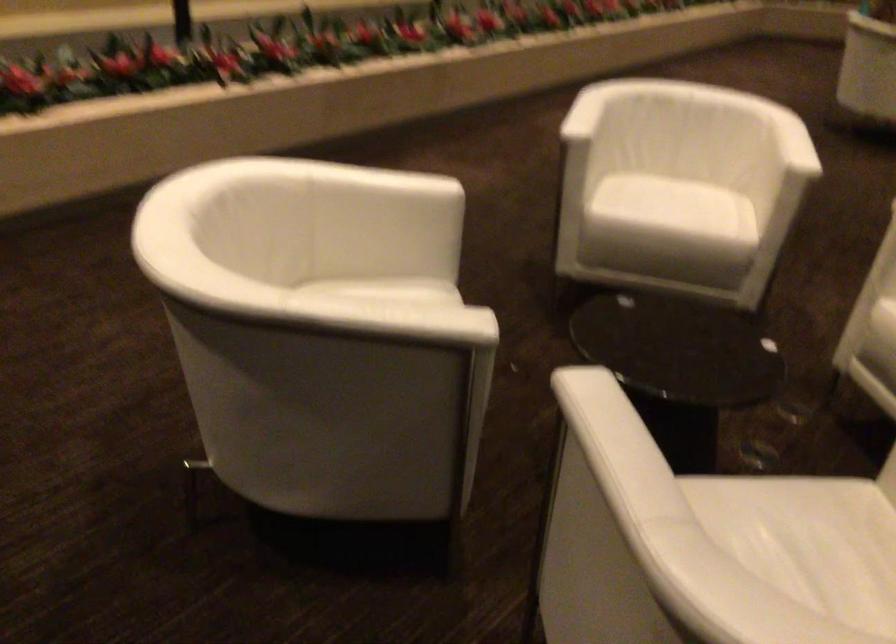
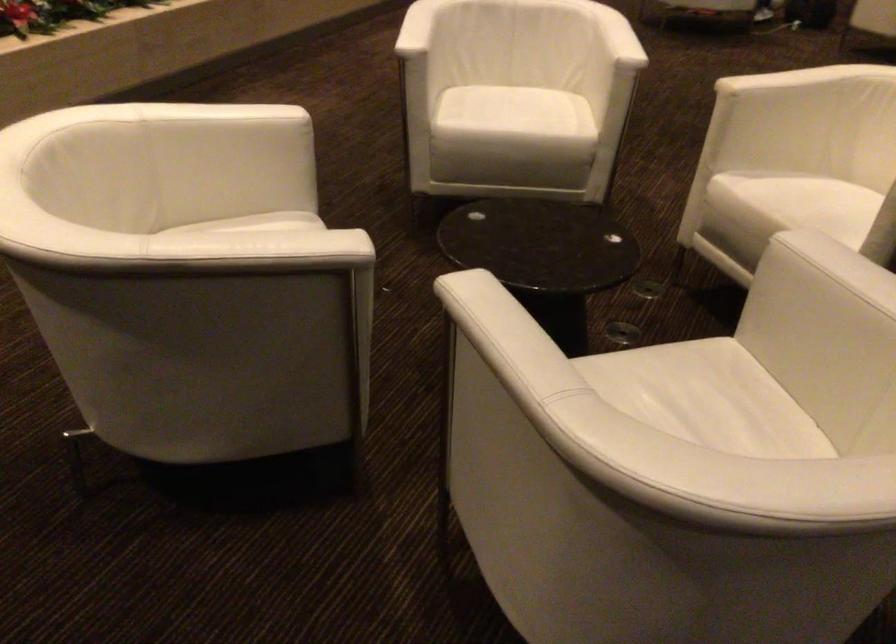
Question: The camera is either moving clockwise (left) or counter-clockwise (right) around the object. The first image is from the beginning of the video and the second image is from the end. Is the camera moving left or right when shooting the video?

Choices:
 (A) Left
 (B) Right

Answer: (A)